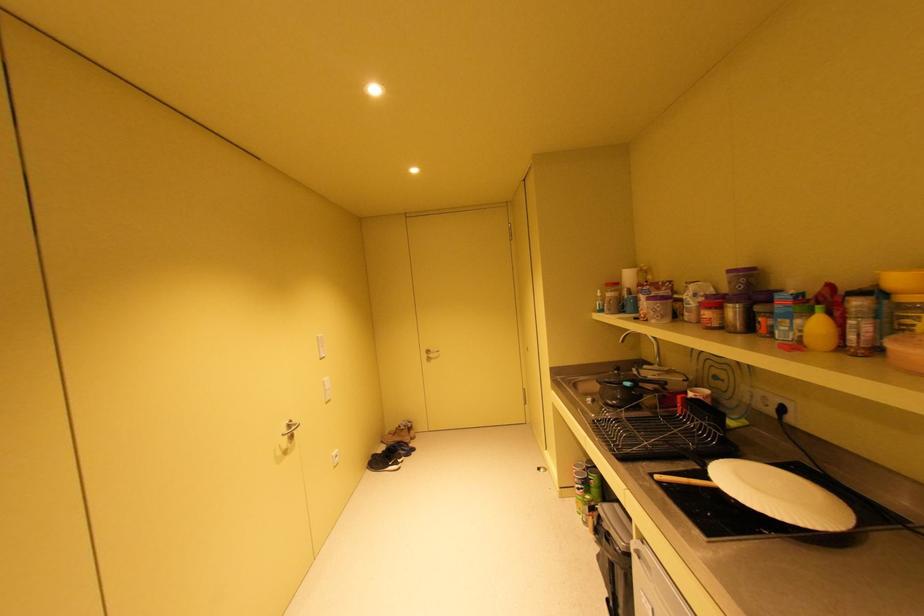
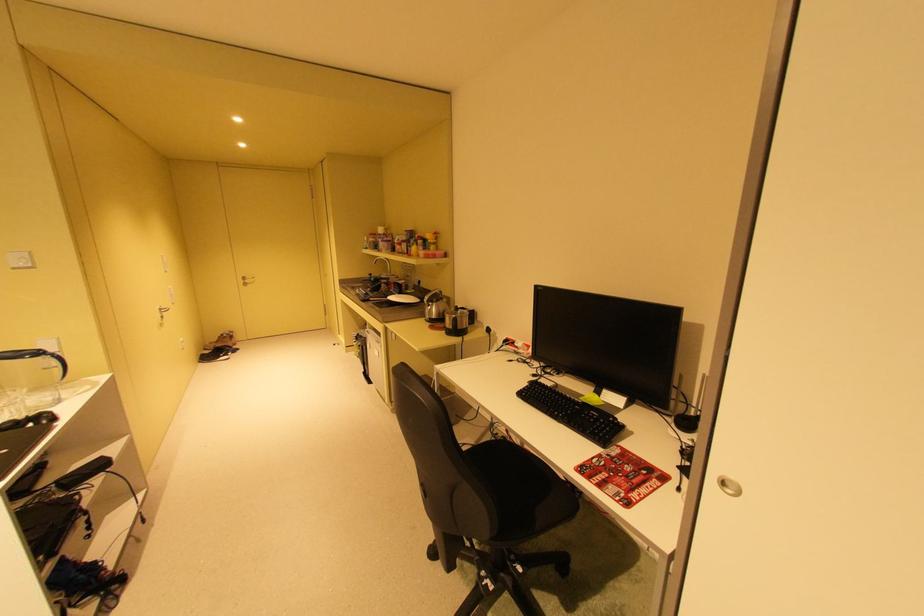
Locate, in the second image, the point that corresponds to (x=435, y=352) in the first image.

(252, 278)